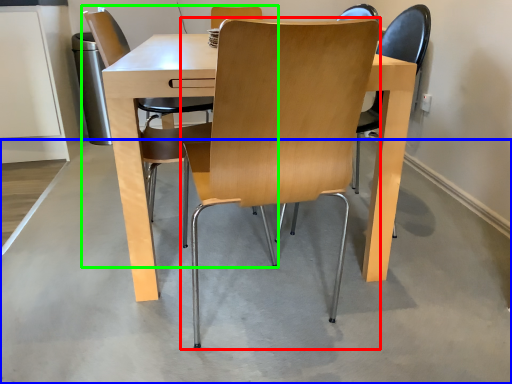
Question: Which is nearer to the chair (highlighted by a red box)? concrete (highlighted by a blue box) or chair (highlighted by a green box).

Choices:
 (A) concrete
 (B) chair

Answer: (A)